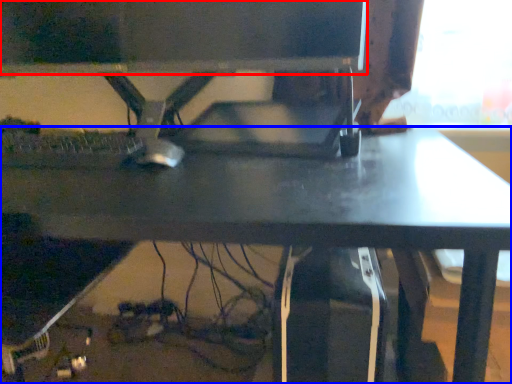
Question: Among these objects, which one is farthest to the camera, computer monitor (highlighted by a red box) or desk (highlighted by a blue box)?

Choices:
 (A) computer monitor
 (B) desk

Answer: (A)